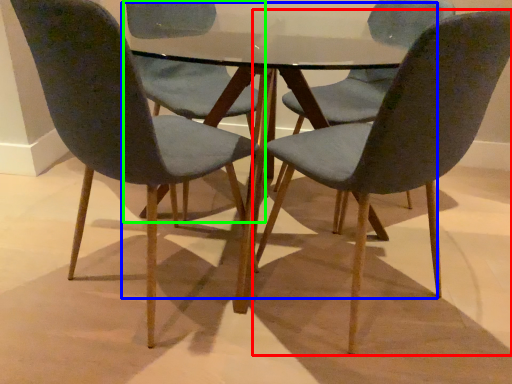
Question: Which is nearer to the chair (highlighted by a red box)? round table (highlighted by a blue box) or chair (highlighted by a green box).

Choices:
 (A) round table
 (B) chair

Answer: (A)